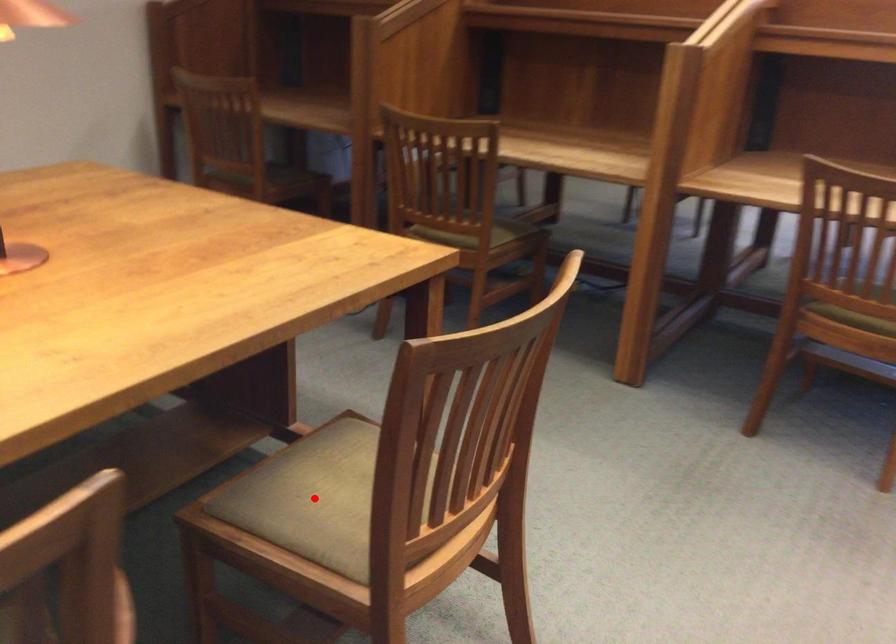
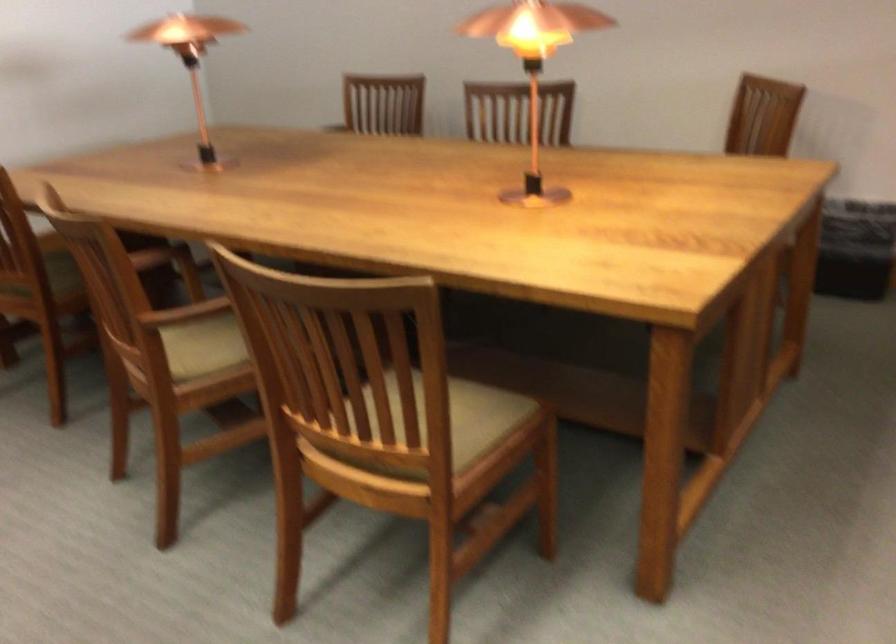
Question: I am providing you with two images of the same scene from different viewpoints. A red point is marked on the first image. Is the red point's position out of view in image 2?

Choices:
 (A) Yes
 (B) No

Answer: (A)